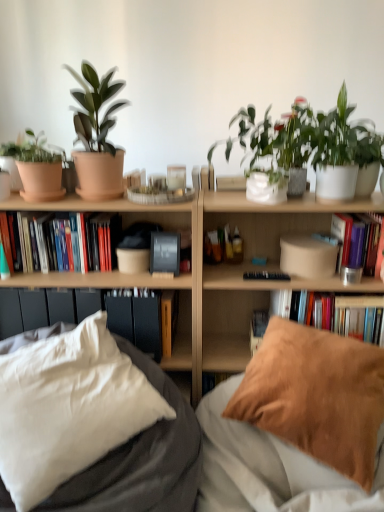
Question: Is matte clay pot at left, acting as the 1th flowerpot starting from the left, taller than hardcover books at left, which appears as the 3th book when viewed from the right?

Choices:
 (A) yes
 (B) no

Answer: (B)

Question: Is matte clay pot at left, acting as the first flowerpot starting from the top, wider than hardcover books at left, which appears as the 3th book when viewed from the right?

Choices:
 (A) yes
 (B) no

Answer: (B)

Question: Considering the relative positions of matte clay pot at left, marked as the 3th flowerpot in a bottom-to-top arrangement, and hardcover books at left, marked as the first book in a left-to-right arrangement, in the image provided, is matte clay pot at left, marked as the 3th flowerpot in a bottom-to-top arrangement, to the right of hardcover books at left, marked as the first book in a left-to-right arrangement, from the viewer's perspective?

Choices:
 (A) no
 (B) yes

Answer: (A)

Question: Can you confirm if matte clay pot at left, marked as the 3th flowerpot in a bottom-to-top arrangement, is thinner than hardcover books at left, marked as the first book in a left-to-right arrangement?

Choices:
 (A) yes
 (B) no

Answer: (A)

Question: Considering the relative sizes of matte clay pot at left, marked as the 3th flowerpot in a bottom-to-top arrangement, and hardcover books at left, marked as the first book in a left-to-right arrangement, in the image provided, is matte clay pot at left, marked as the 3th flowerpot in a bottom-to-top arrangement, shorter than hardcover books at left, marked as the first book in a left-to-right arrangement,?

Choices:
 (A) yes
 (B) no

Answer: (A)

Question: Does matte clay pot at left, marked as the 3th flowerpot in a bottom-to-top arrangement, turn towards hardcover books at left, which appears as the 3th book when viewed from the right?

Choices:
 (A) no
 (B) yes

Answer: (A)

Question: Is matte clay pot at left, acting as the 1th flowerpot starting from the left, further to the viewer compared to hardcover book at upper right, the 1th book in the right-to-left sequence?

Choices:
 (A) yes
 (B) no

Answer: (B)

Question: Considering the relative sizes of matte clay pot at left, marked as the 3th flowerpot in a bottom-to-top arrangement, and hardcover book at upper right, the third book from the left, in the image provided, is matte clay pot at left, marked as the 3th flowerpot in a bottom-to-top arrangement, wider than hardcover book at upper right, the third book from the left,?

Choices:
 (A) yes
 (B) no

Answer: (B)

Question: Does matte clay pot at left, which appears as the 3th flowerpot when viewed from the right, have a lesser height compared to hardcover book at upper right, the third book from the left?

Choices:
 (A) no
 (B) yes

Answer: (B)

Question: From the image's perspective, does matte clay pot at left, acting as the 1th flowerpot starting from the left, appear higher than hardcover book at upper right, the 1th book in the right-to-left sequence?

Choices:
 (A) yes
 (B) no

Answer: (A)

Question: From a real-world perspective, does matte clay pot at left, marked as the 3th flowerpot in a bottom-to-top arrangement, stand above hardcover book at upper right, the 1th book in the right-to-left sequence?

Choices:
 (A) yes
 (B) no

Answer: (A)

Question: Is hardcover book at upper right, the 1th book in the right-to-left sequence, completely or partially inside matte clay pot at left, acting as the 1th flowerpot starting from the left?

Choices:
 (A) no
 (B) yes

Answer: (A)

Question: Is the surface of brown suede pillow at lower right, the first pillow when ordered from right to left, in direct contact with hardcover book at upper right, the third book from the left?

Choices:
 (A) no
 (B) yes

Answer: (A)